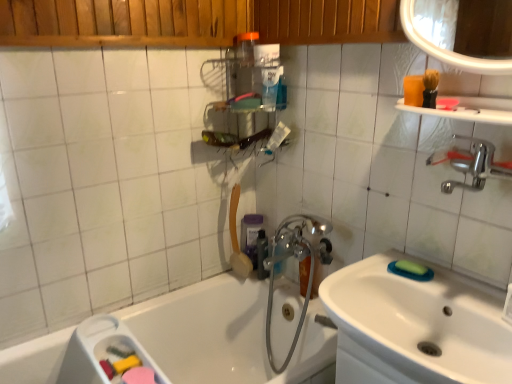
Question: From the image's perspective, is matte orange shower head at upper center located above or below green sponge at sink?

Choices:
 (A) below
 (B) above

Answer: (B)

Question: From a real-world perspective, is matte orange shower head at upper center positioned above or below green sponge at sink?

Choices:
 (A) above
 (B) below

Answer: (B)

Question: Estimate the real-world distances between objects in this image. Which object is closer to the metallic silver shelf at upper center?

Choices:
 (A) white glossy sink at lower right
 (B) green sponge at sink
 (C) purple matte soap dispenser at upper center, the 2th toiletry positioned from the bottom
 (D) transparent plastic bottle at upper center, the 1th toiletry positioned from the top
 (E) black plastic bottle at center, placed as the second toiletry when sorted from front to back

Answer: (D)

Question: Which is farther from the transparent plastic bottle at upper center, which is the 3th toiletry from back to front?

Choices:
 (A) green sponge at sink
 (B) black plastic bottle at center, the second toiletry positioned from the back
 (C) purple matte soap dispenser at upper center, acting as the 3th toiletry starting from the front
 (D) chrome metallic faucet at center
 (E) white glossy sink at lower right

Answer: (E)